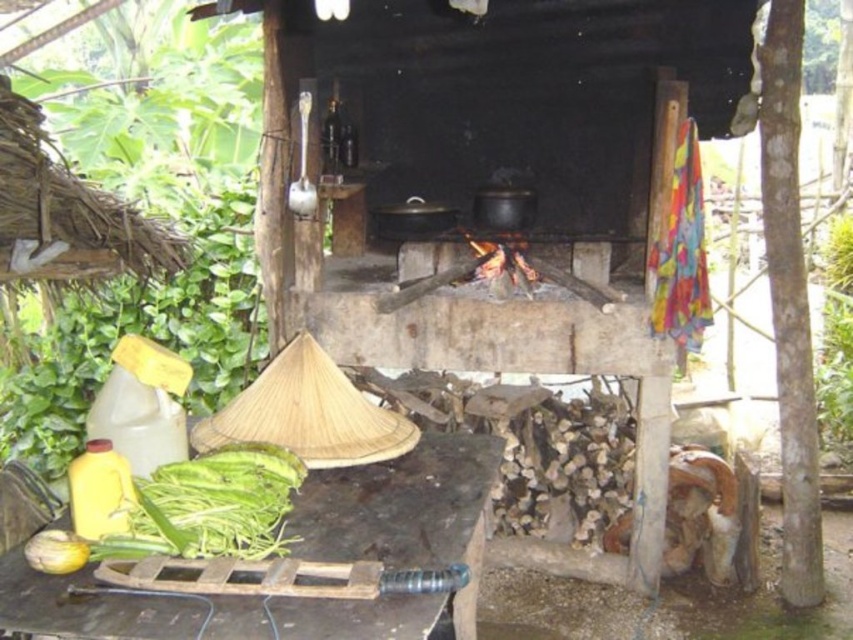
You are standing in the rustic outdoor cooking area and want to place a new pot between the two existing pots. The coordinates of the two existing pots are point (347, 522) and point (216, 502). According to their positions, which pot is closer to you so you can place the new pot in between them?

Point (216, 502) is closer to you, so you should place the new pot between point (347, 522) and point (216, 502), with the closer pot being point (216, 502).

Looking at this image, you are preparing to set up a cooking station in the rustic outdoor area shown. You have a wooden table at lower left and green leafy vegetables at lower left. Where should you place the vegetables to keep them fresh while cooking?

The green leafy vegetables at lower left should be placed above the wooden table at lower left since the wooden table is below them, keeping them elevated and away from potential heat sources.

You are setting up a rustic outdoor cooking area and have a wooden table at lower left and green leafy vegetables at lower left. Which object is wider?

The wooden table at lower left might be wider than green leafy vegetables at lower left according to the description.